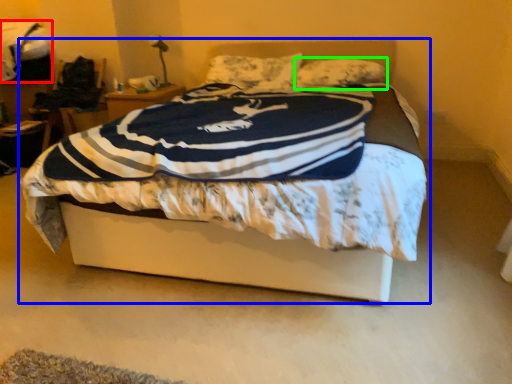
Question: Based on their relative distances, which object is nearer to blanket (highlighted by a red box)? Choose from bed (highlighted by a blue box) and pillow (highlighted by a green box).

Choices:
 (A) bed
 (B) pillow

Answer: (B)